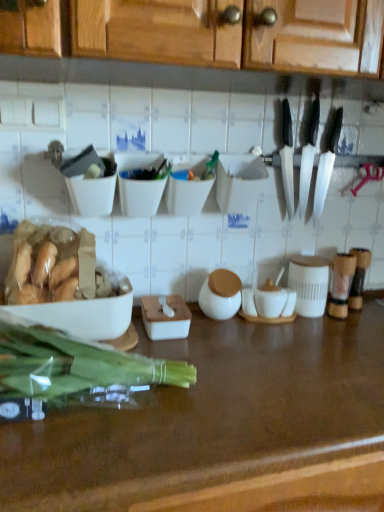
Question: Considering the positions of white plastic container at center, acting as the third bowl starting from the left, and white matte bowl at left in the image, is white plastic container at center, acting as the third bowl starting from the left, taller or shorter than white matte bowl at left?

Choices:
 (A) short
 (B) tall

Answer: (B)

Question: Choose the correct answer: Is white plastic container at center, the 1th bowl from the right, inside white matte bowl at left or outside it?

Choices:
 (A) outside
 (B) inside

Answer: (A)

Question: Which is nearer to the brown polished wood countertop at center?

Choices:
 (A) white plastic container at center, acting as the third bowl starting from the left
 (B) translucent plastic green vegetables at left
 (C) black plastic knife at upper right, the first kitchen knife positioned from the left
 (D) white matte bowl at upper center, which is counted as the second bowl, starting from the left
 (E) black plastic knives at upper right

Answer: (B)

Question: Which is nearer to the black plastic knives at upper right?

Choices:
 (A) black plastic knife at upper right, the first kitchen knife positioned from the left
 (B) translucent plastic green vegetables at left
 (C) brown polished wood countertop at center
 (D) white matte bowl at left
 (E) white plastic container at center, the 1th bowl from the right

Answer: (A)